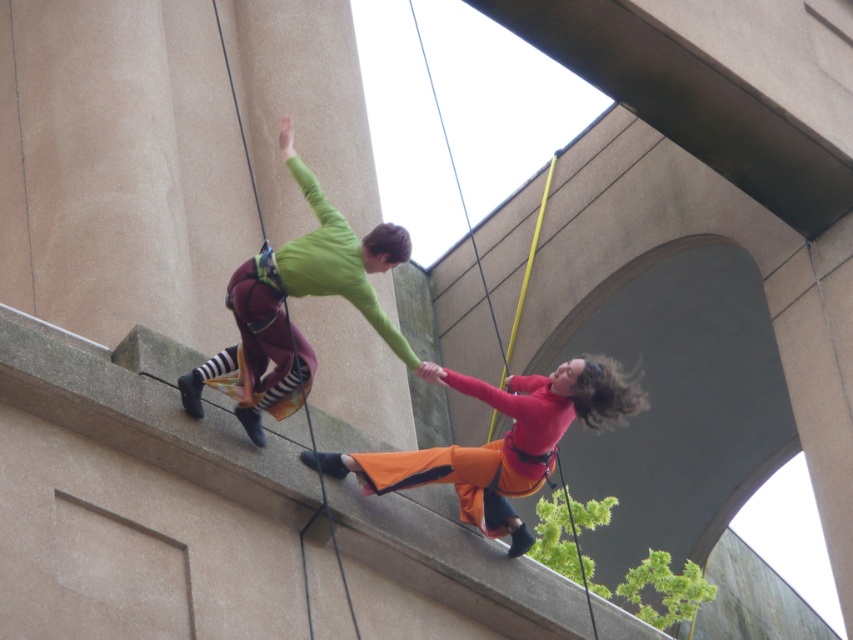
Question: Which point is farther to the camera?

Choices:
 (A) (399, 237)
 (B) (485, 483)
 (C) (178, 378)

Answer: (B)

Question: Does green fabric climbing harness at upper center come in front of orange fabric pants at lower center?

Choices:
 (A) yes
 (B) no

Answer: (A)

Question: Is green fabric climbing harness at upper center bigger than matte green long-sleeve shirt at upper center?

Choices:
 (A) yes
 (B) no

Answer: (A)

Question: Based on their relative distances, which object is farther from the orange fabric pants at lower center?

Choices:
 (A) green fabric climbing harness at upper center
 (B) matte green long-sleeve shirt at upper center

Answer: (B)

Question: Which point is farther from the camera taking this photo?

Choices:
 (A) (538, 474)
 (B) (395, 349)
 (C) (515, 486)

Answer: (C)

Question: Does green fabric climbing harness at upper center appear on the right side of orange fabric pants at lower center?

Choices:
 (A) no
 (B) yes

Answer: (A)